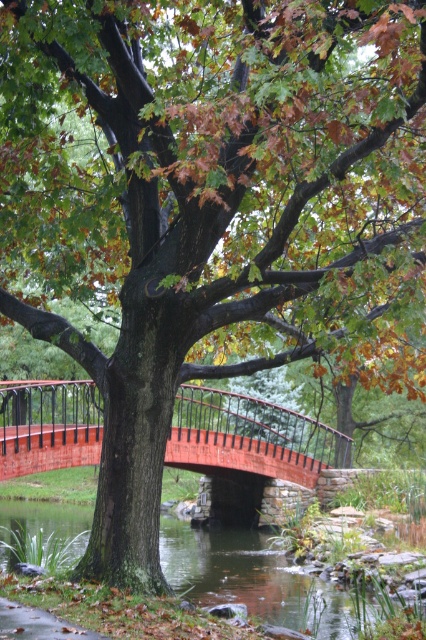
Question: Is wooden bridge at center below clear water at center?

Choices:
 (A) no
 (B) yes

Answer: (A)

Question: Which object is farther from the camera taking this photo?

Choices:
 (A) clear water at center
 (B) wooden bridge at center

Answer: (B)

Question: Which point appears closest to the camera in this image?

Choices:
 (A) (198, 400)
 (B) (178, 552)

Answer: (B)

Question: Does wooden bridge at center come behind clear water at center?

Choices:
 (A) no
 (B) yes

Answer: (B)

Question: Is wooden bridge at center closer to the viewer compared to clear water at center?

Choices:
 (A) yes
 (B) no

Answer: (B)